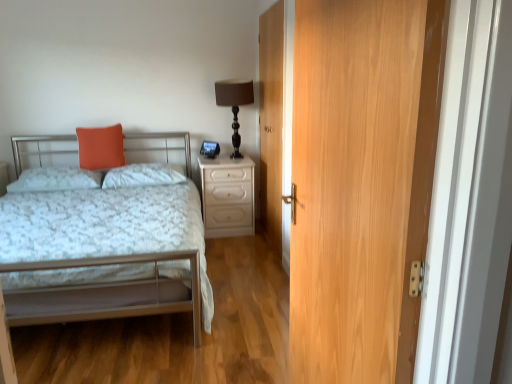
Question: In terms of height, does metallic silver bed at left look taller or shorter compared to white fluffy pillow at center, the 2th pillow viewed from the left?

Choices:
 (A) tall
 (B) short

Answer: (A)

Question: From the image's perspective, is metallic silver bed at left positioned above or below white fluffy pillow at center, which is the first pillow in right-to-left order?

Choices:
 (A) below
 (B) above

Answer: (A)

Question: Based on their relative distances, which object is farther from the wooden door at center, which appears as the first door when viewed from the back?

Choices:
 (A) matte black table lamp at upper center
 (B) orange matte pillow at upper left
 (C) metallic silver bed at left
 (D) white glossy nightstand at right
 (E) matte orange pillow at upper left, the first pillow positioned from the left

Answer: (E)

Question: Estimate the real-world distances between objects in this image. Which object is farther from the metallic silver bed at left?

Choices:
 (A) matte orange pillow at upper left, acting as the 2th pillow starting from the right
 (B) matte black table lamp at upper center
 (C) light brown wood door at right, which is counted as the 2th door, starting from the back
 (D) white glossy nightstand at right
 (E) white fluffy pillow at center, the 2th pillow viewed from the left

Answer: (B)